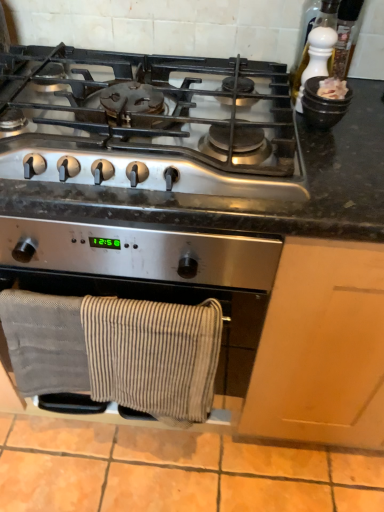
Question: Should I look upward or downward to see white ceramic pepper grinder at upper right?

Choices:
 (A) down
 (B) up

Answer: (B)

Question: Does white ceramic pepper grinder at upper right turn towards gray cotton towels at lower center?

Choices:
 (A) yes
 (B) no

Answer: (B)

Question: Is white ceramic pepper grinder at upper right behind gray cotton towels at lower center?

Choices:
 (A) no
 (B) yes

Answer: (B)

Question: Considering the relative positions of white ceramic pepper grinder at upper right and gray cotton towels at lower center in the image provided, is white ceramic pepper grinder at upper right to the left of gray cotton towels at lower center from the viewer's perspective?

Choices:
 (A) yes
 (B) no

Answer: (B)

Question: Is white ceramic pepper grinder at upper right far away from gray cotton towels at lower center?

Choices:
 (A) no
 (B) yes

Answer: (A)

Question: Can you confirm if white ceramic pepper grinder at upper right is taller than gray cotton towels at lower center?

Choices:
 (A) yes
 (B) no

Answer: (B)

Question: Considering the relative sizes of white ceramic pepper grinder at upper right and gray cotton towels at lower center in the image provided, is white ceramic pepper grinder at upper right bigger than gray cotton towels at lower center?

Choices:
 (A) no
 (B) yes

Answer: (A)

Question: Does satin silver gas stove at upper center appear on the left side of white ceramic pepper grinder at upper right?

Choices:
 (A) yes
 (B) no

Answer: (A)

Question: Can you confirm if satin silver gas stove at upper center is bigger than white ceramic pepper grinder at upper right?

Choices:
 (A) no
 (B) yes

Answer: (B)

Question: From the image's perspective, is satin silver gas stove at upper center on top of white ceramic pepper grinder at upper right?

Choices:
 (A) yes
 (B) no

Answer: (B)

Question: Is satin silver gas stove at upper center facing away from white ceramic pepper grinder at upper right?

Choices:
 (A) no
 (B) yes

Answer: (A)

Question: Is the position of satin silver gas stove at upper center less distant than that of white ceramic pepper grinder at upper right?

Choices:
 (A) yes
 (B) no

Answer: (A)

Question: Is satin silver gas stove at upper center not close to white ceramic pepper grinder at upper right?

Choices:
 (A) no
 (B) yes

Answer: (A)

Question: Is satin silver gas stove at upper center positioned in front of gray cotton towels at lower center?

Choices:
 (A) no
 (B) yes

Answer: (B)